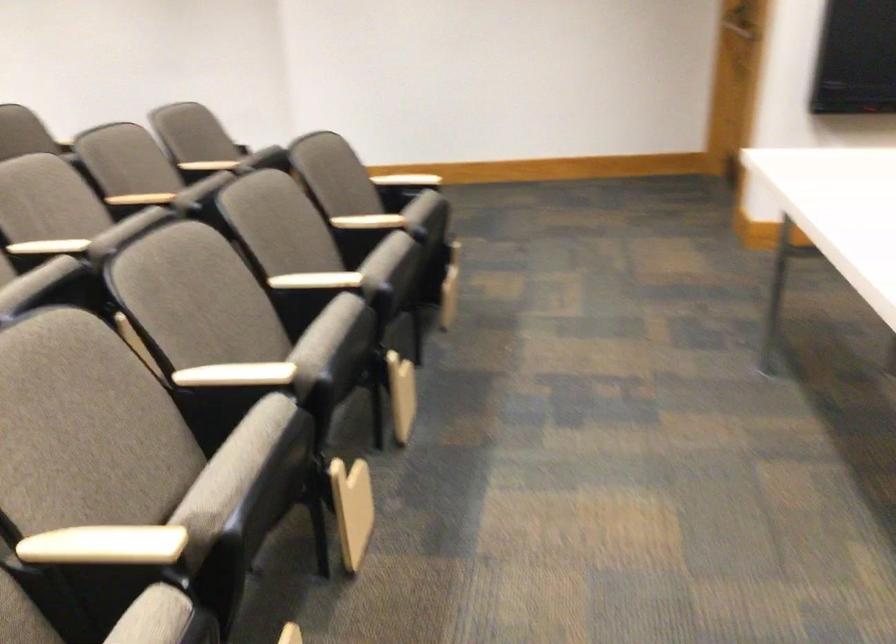
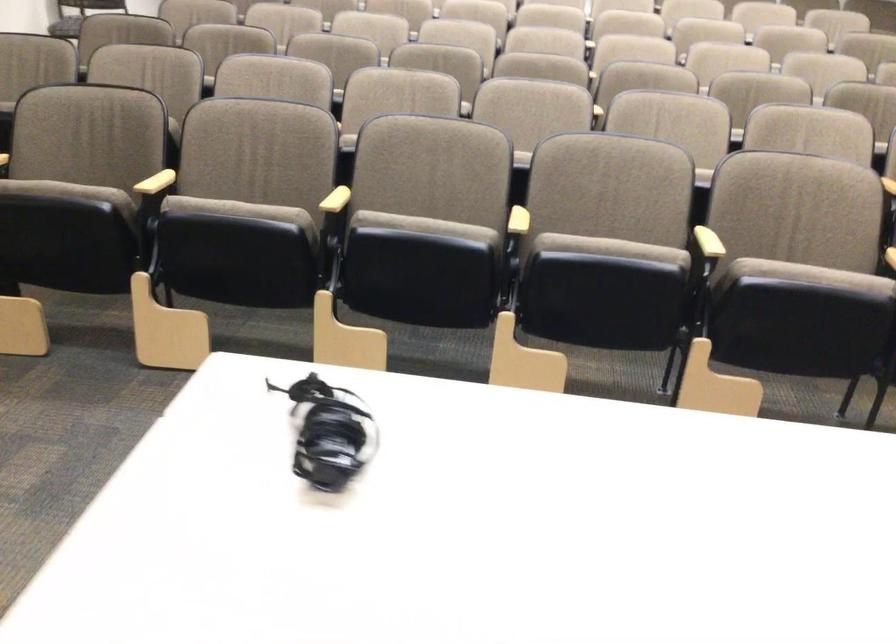
In the second image, find the point that corresponds to (x=317, y=272) in the first image.

(709, 242)